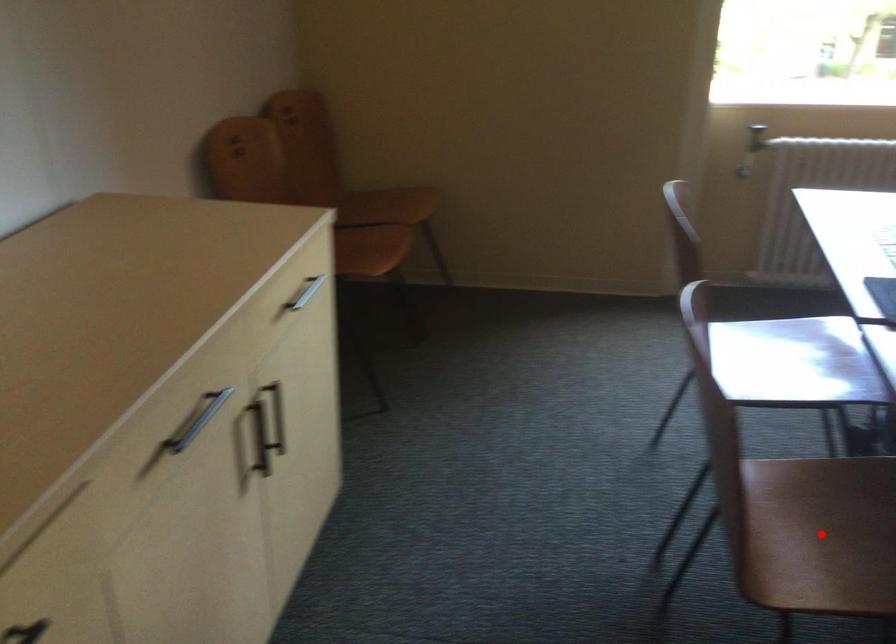
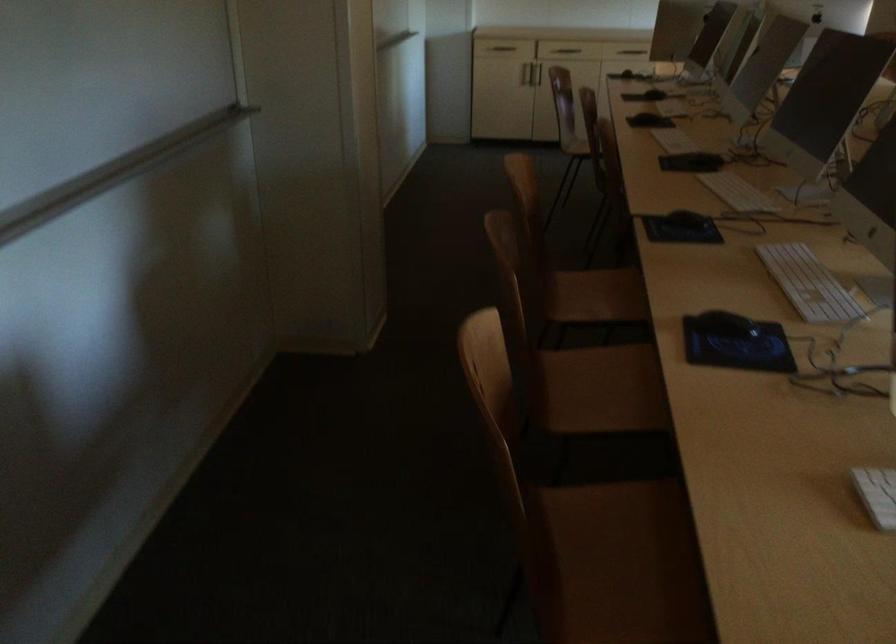
Question: I am providing you with two images of the same scene from different viewpoints. A red point is marked on the first image. Is the red point's position out of view in image 2?

Choices:
 (A) Yes
 (B) No

Answer: (A)